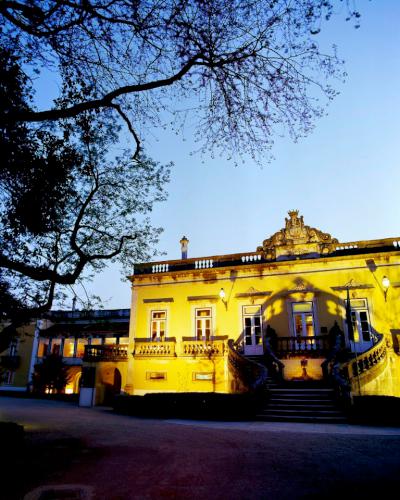
At what (x,y) coordinates should I click in order to perform the action: click on 1 large set of windows on the left side. Please return your answer as a coordinate pair (x, y). This screenshot has width=400, height=500. Looking at the image, I should click on (70, 346).